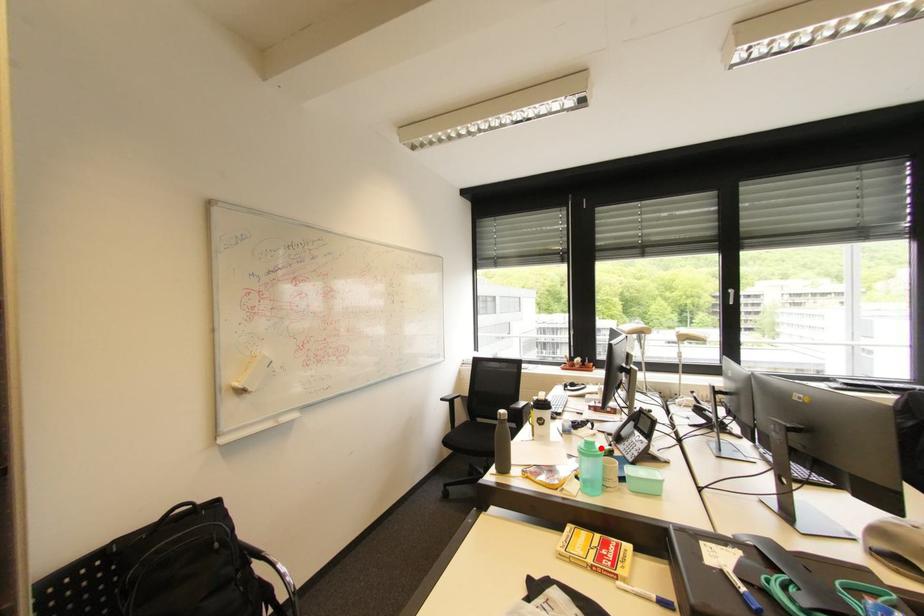
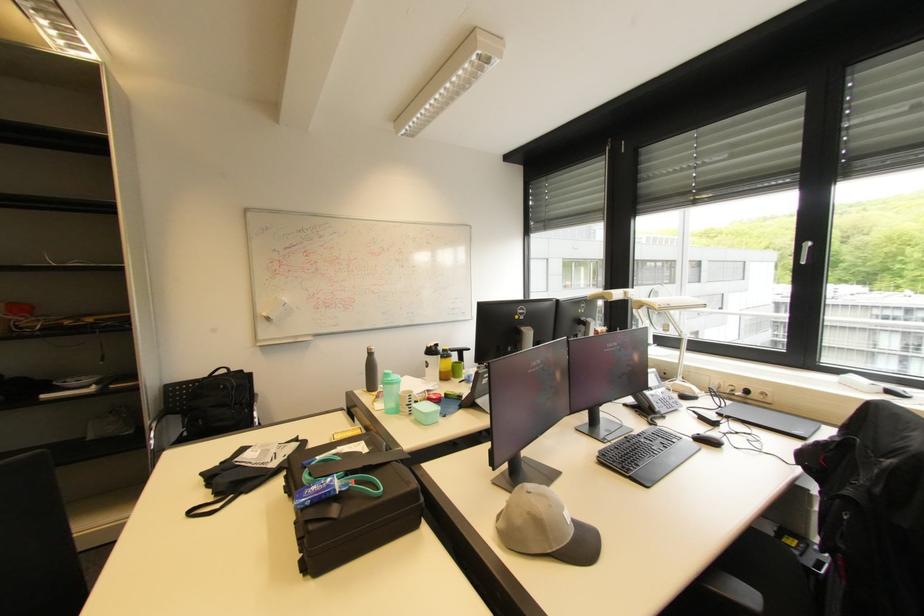
Locate, in the second image, the point that corresponds to the highlighted location in the first image.

(394, 379)